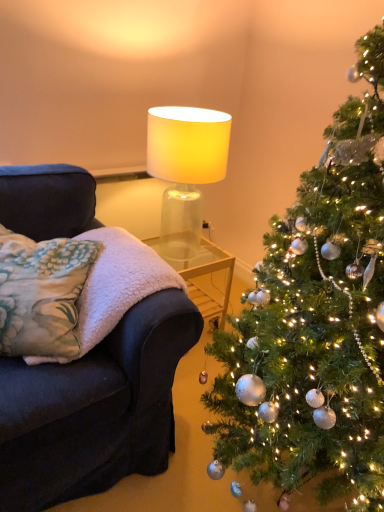
Question: Can you confirm if fluffy floral pillow at left is smaller than shiny silver ornaments at right?

Choices:
 (A) no
 (B) yes

Answer: (B)

Question: Can you confirm if fluffy floral pillow at left is shorter than shiny silver ornaments at right?

Choices:
 (A) yes
 (B) no

Answer: (A)

Question: Is fluffy floral pillow at left closer to camera compared to shiny silver ornaments at right?

Choices:
 (A) no
 (B) yes

Answer: (A)

Question: Considering the relative positions of fluffy floral pillow at left and shiny silver ornaments at right in the image provided, is fluffy floral pillow at left to the right of shiny silver ornaments at right from the viewer's perspective?

Choices:
 (A) yes
 (B) no

Answer: (B)

Question: Is fluffy floral pillow at left surrounding shiny silver ornaments at right?

Choices:
 (A) no
 (B) yes

Answer: (A)

Question: Is translucent glass lampshade at upper center taller or shorter than fluffy floral pillow at left?

Choices:
 (A) tall
 (B) short

Answer: (A)

Question: Choose the correct answer: Is translucent glass lampshade at upper center inside fluffy floral pillow at left or outside it?

Choices:
 (A) inside
 (B) outside

Answer: (B)

Question: Is translucent glass lampshade at upper center in front of or behind fluffy floral pillow at left in the image?

Choices:
 (A) front
 (B) behind

Answer: (B)

Question: In terms of width, does translucent glass lampshade at upper center look wider or thinner when compared to fluffy floral pillow at left?

Choices:
 (A) thin
 (B) wide

Answer: (A)

Question: Which is correct: fluffy floral pillow at left is inside fluffy white blanket at left, or outside of it?

Choices:
 (A) inside
 (B) outside

Answer: (A)

Question: Based on their sizes in the image, would you say fluffy floral pillow at left is bigger or smaller than fluffy white blanket at left?

Choices:
 (A) big
 (B) small

Answer: (B)

Question: Is fluffy floral pillow at left in front of or behind fluffy white blanket at left in the image?

Choices:
 (A) front
 (B) behind

Answer: (B)

Question: From a real-world perspective, is fluffy floral pillow at left above or below fluffy white blanket at left?

Choices:
 (A) above
 (B) below

Answer: (A)

Question: From a real-world perspective, is translucent glass lampshade at upper center above or below shiny silver ornaments at right?

Choices:
 (A) above
 (B) below

Answer: (A)

Question: Would you say translucent glass lampshade at upper center is to the left or to the right of shiny silver ornaments at right in the picture?

Choices:
 (A) right
 (B) left

Answer: (B)